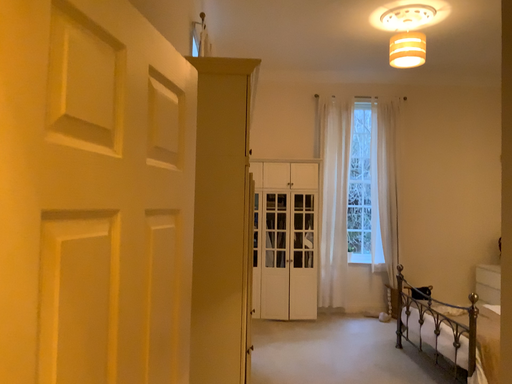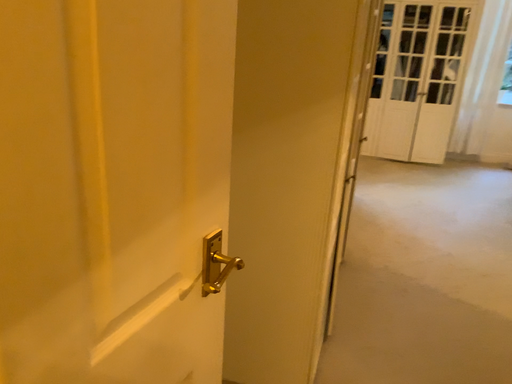
Question: How did the camera likely rotate when shooting the video?

Choices:
 (A) rotated upward
 (B) rotated downward

Answer: (B)